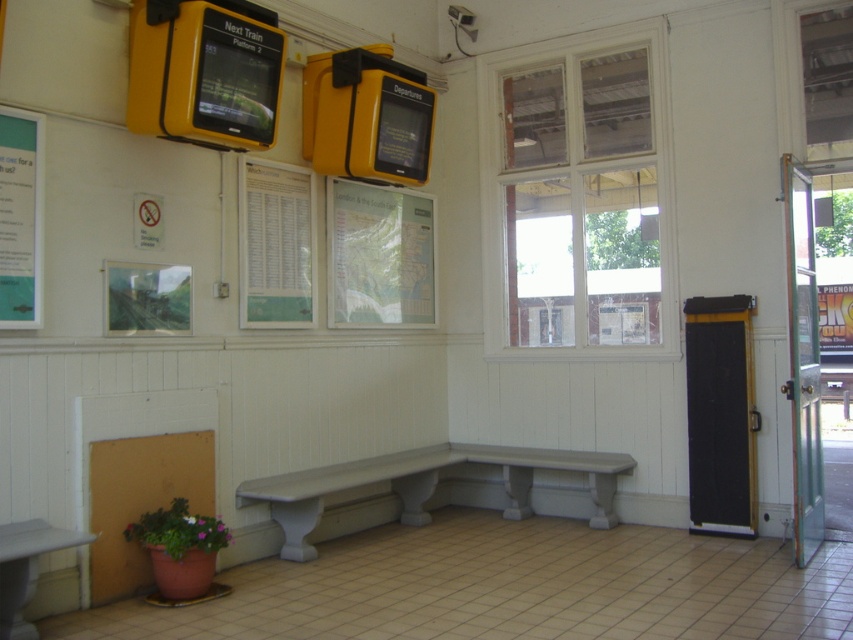
Question: Which of the following is the closest to the observer?

Choices:
 (A) (820, 460)
 (B) (10, 134)
 (C) (354, 464)

Answer: (B)

Question: Which object appears closest to the camera in this image?

Choices:
 (A) green paper at center
 (B) black wood door at right
 (C) white painted wood bench at center

Answer: (C)

Question: Can you confirm if clear glass door at right is positioned to the right of teal glossy poster at left?

Choices:
 (A) no
 (B) yes

Answer: (B)

Question: Which point is closer to the camera?

Choices:
 (A) (289, 179)
 (B) (720, 337)
 (C) (460, 461)

Answer: (A)

Question: Is white painted wood bench at center to the left of smooth gray bench at center from the viewer's perspective?

Choices:
 (A) yes
 (B) no

Answer: (A)

Question: Where is white painted wood bench at center located in relation to black wood door at right in the image?

Choices:
 (A) left
 (B) right

Answer: (A)